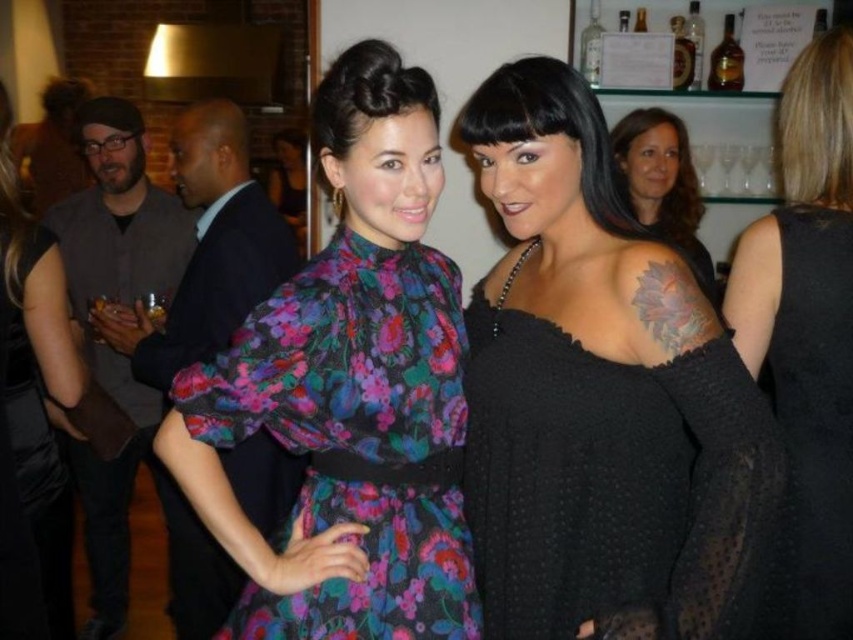
You are a photographer at the event and want to ensure both the black dotted sweater at upper center and the black dotted dress at upper right are clearly visible in your photo. Given their sizes, which one might require you to adjust your camera focus more carefully to avoid blurring?

The black dotted sweater at upper center has a smaller size compared to the black dotted dress at upper right, so it might require more careful focus adjustment to ensure clarity.

You are a photographer at the event and want to capture the floral print fabric dress at center without the black dotted sweater at upper center blocking it. Is there a way to adjust your position to achieve this?

The black dotted sweater at upper center is positioned over the floral print fabric dress at center, so moving your camera angle downward or to the side might allow you to frame the dress without the sweater blocking it.